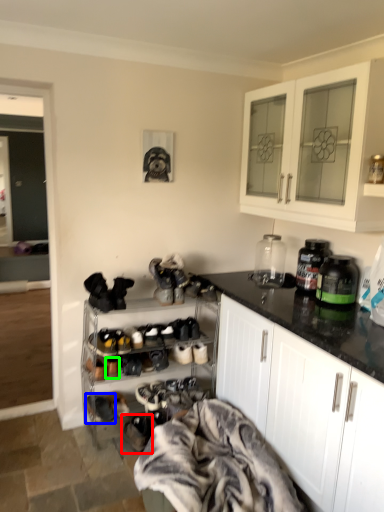
Question: Based on their relative distances, which object is farther from footwear (highlighted by a red box)? Choose from footwear (highlighted by a blue box) and shoe (highlighted by a green box).

Choices:
 (A) footwear
 (B) shoe

Answer: (B)